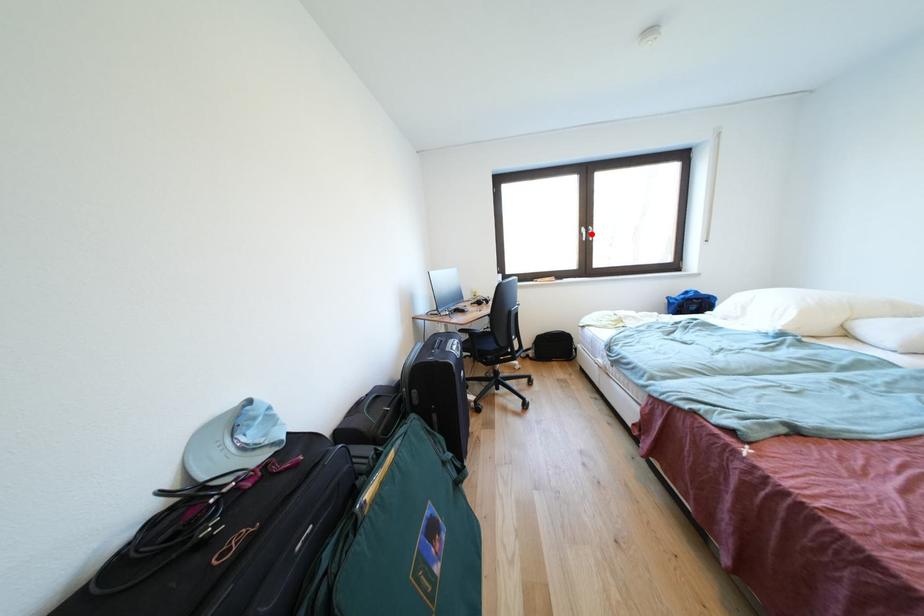
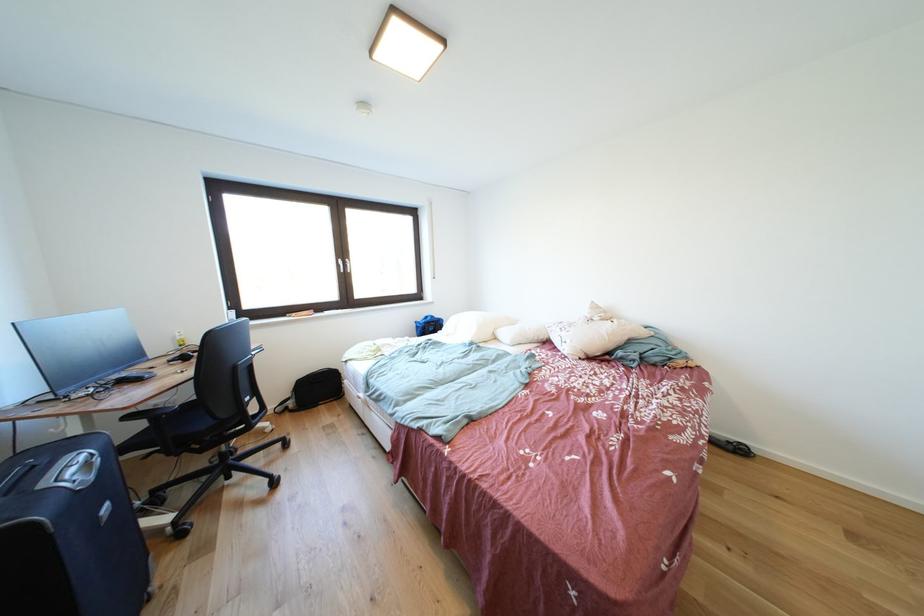
Question: I am providing you with two images of the same scene from different viewpoints. A red point is marked on the first image. Can you still see the location of the red point in image 2?

Choices:
 (A) Yes
 (B) No

Answer: (A)